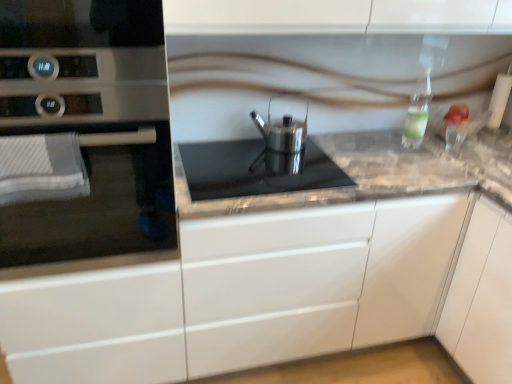
Identify the location of vacant space situated above marble gray counter at center (from a real-world perspective). pos(385,160).